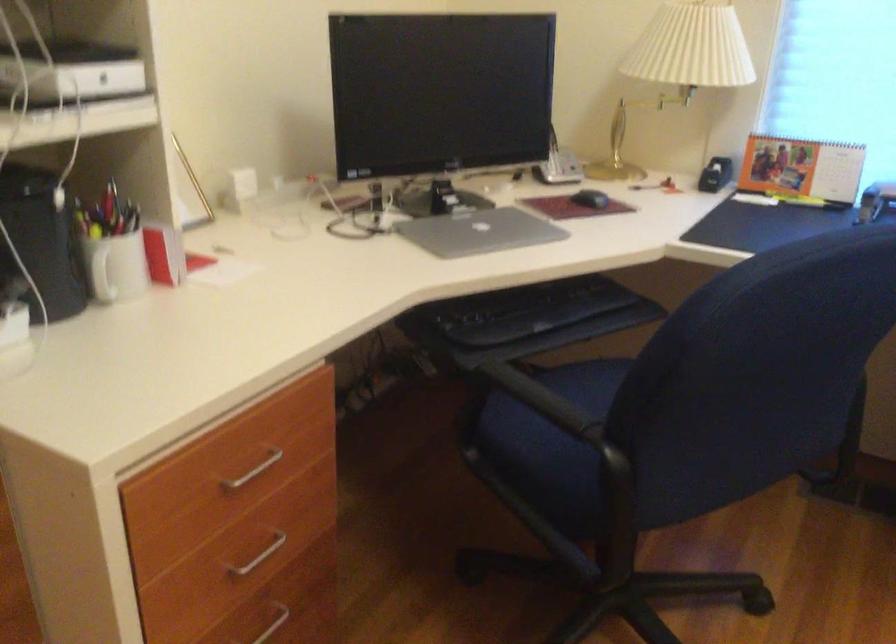
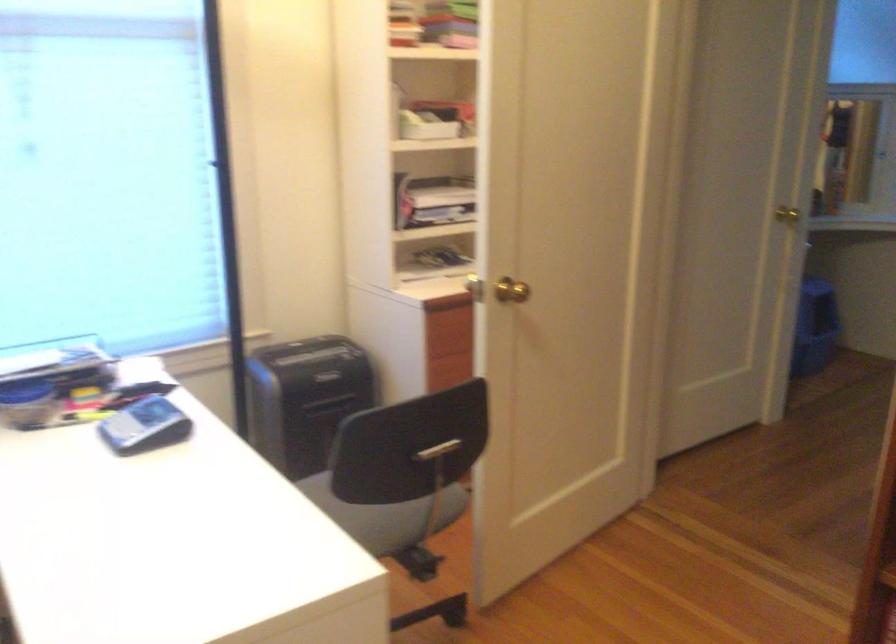
Question: The camera is either moving clockwise (left) or counter-clockwise (right) around the object. The first image is from the beginning of the video and the second image is from the end. Is the camera moving left or right when shooting the video?

Choices:
 (A) Left
 (B) Right

Answer: (A)